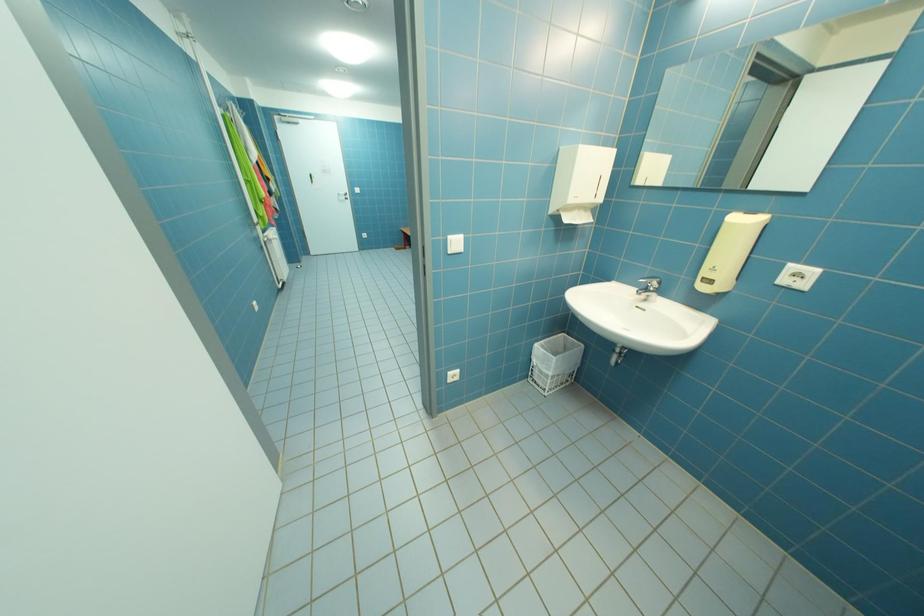
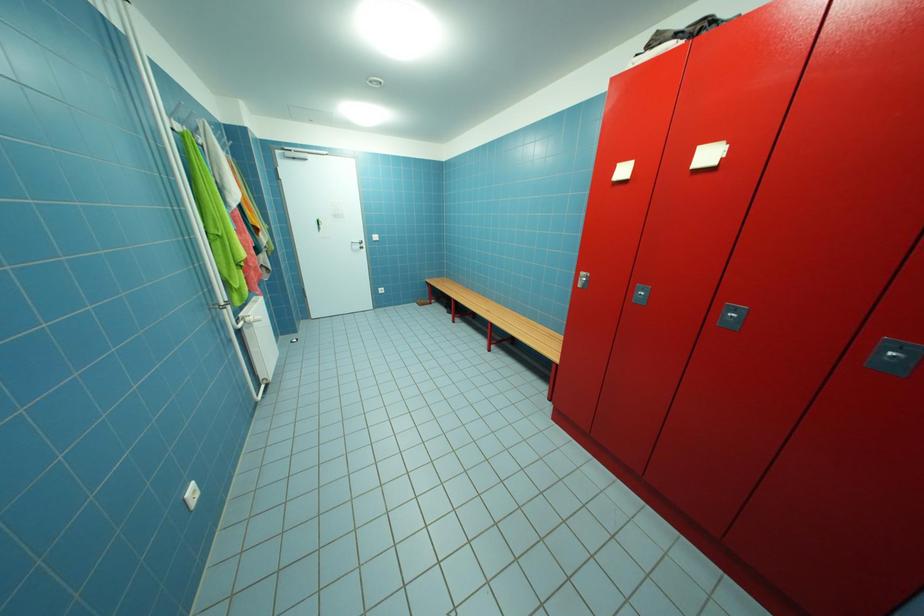
Which direction would the cameraman need to move to produce the second image?

The cameraman moved toward left, forward.